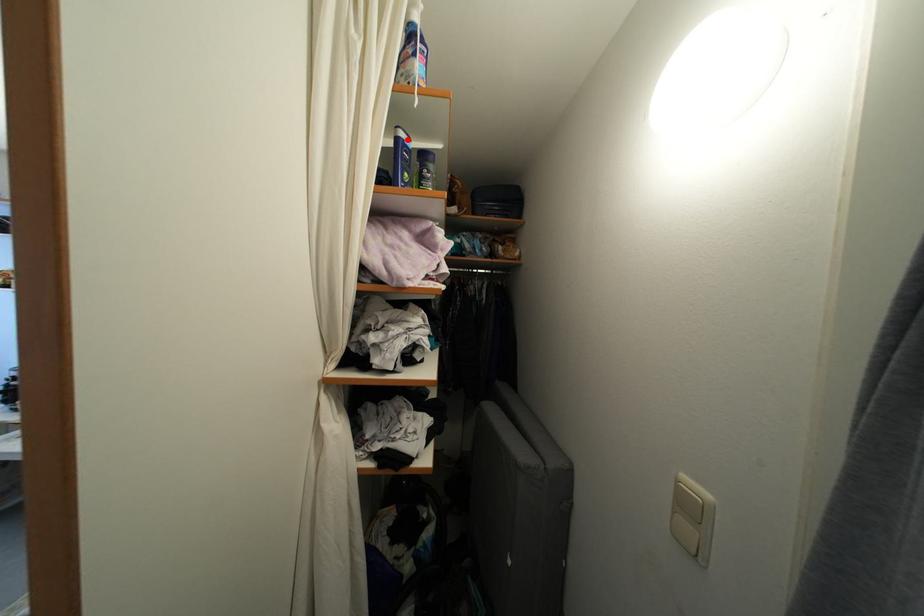
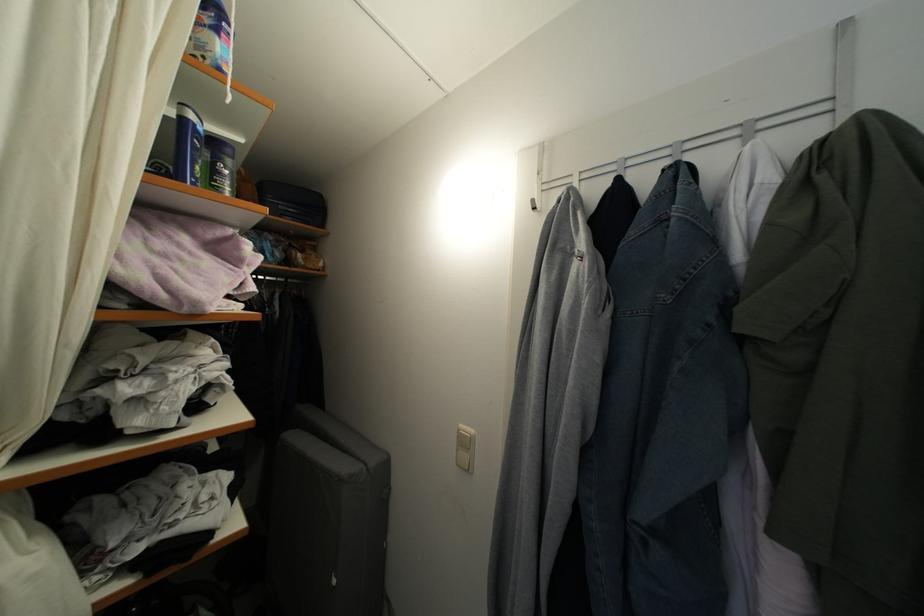
Question: I am providing you with two images of the same scene from different viewpoints. A red point is marked on the first image. Can you still see the location of the red point in image 2?

Choices:
 (A) Yes
 (B) No

Answer: (A)